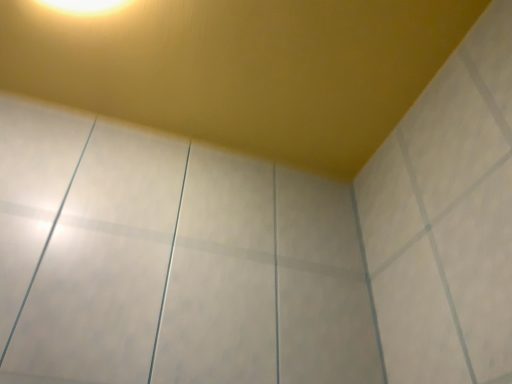
The width and height of the screenshot is (512, 384). What do you see at coordinates (85, 6) in the screenshot?
I see `yellow matte light fixture at upper left` at bounding box center [85, 6].

From the picture: In order to face yellow matte light fixture at upper left, should I rotate leftwards or rightwards?

To align with it, rotate left about 26.030°.

Locate an element on the screen. Image resolution: width=512 pixels, height=384 pixels. yellow matte light fixture at upper left is located at coordinates (85, 6).

Locate an element on the screen. yellow matte light fixture at upper left is located at coordinates (85, 6).